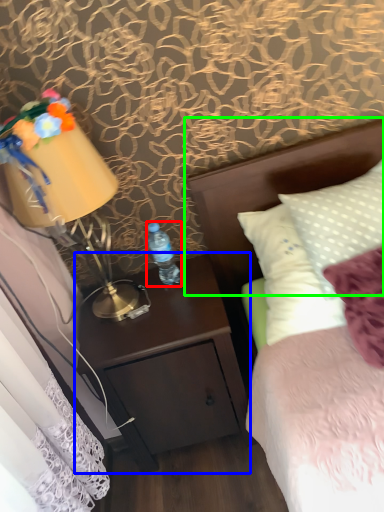
Question: Which object is the closest to the bottle (highlighted by a red box)? Choose among these: nightstand (highlighted by a blue box) or headboard (highlighted by a green box).

Choices:
 (A) nightstand
 (B) headboard

Answer: (A)